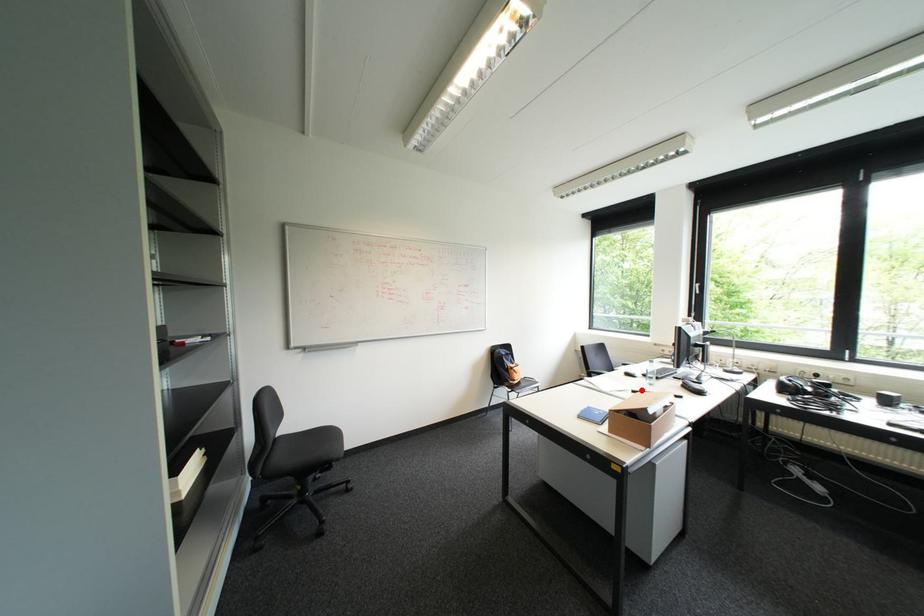
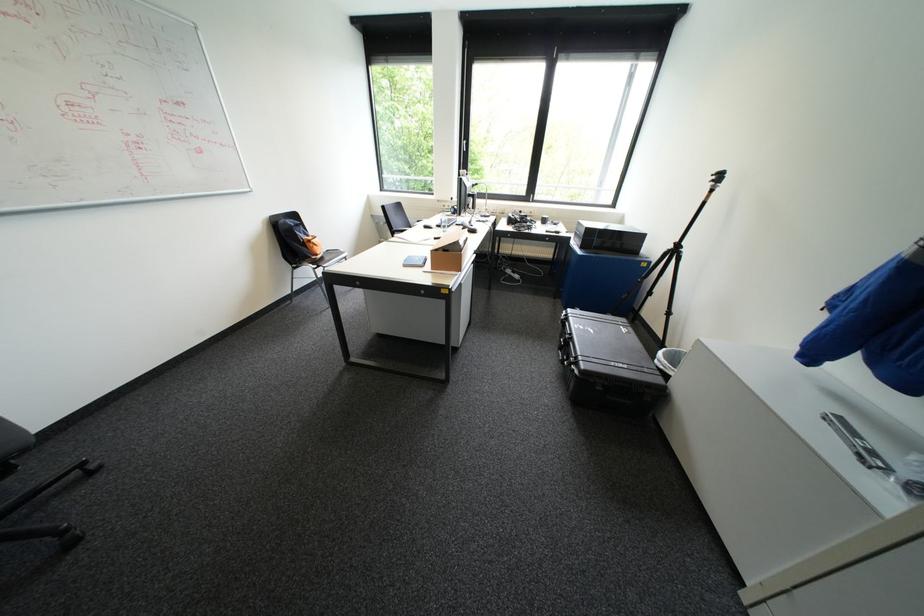
Question: A red point is marked in image1. In image2, is the corresponding 3D point closer to the camera or farther? Reply with the corresponding letter.

Choices:
 (A) The corresponding 3D point is closer.
 (B) The corresponding 3D point is farther.

Answer: (B)